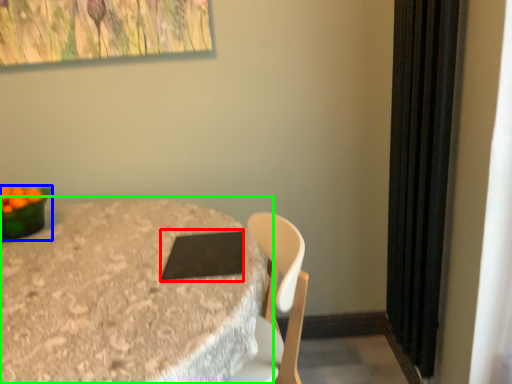
Question: Which object is the closest to the pad (highlighted by a red box)? Choose among these: bowl (highlighted by a blue box) or table (highlighted by a green box).

Choices:
 (A) bowl
 (B) table

Answer: (B)